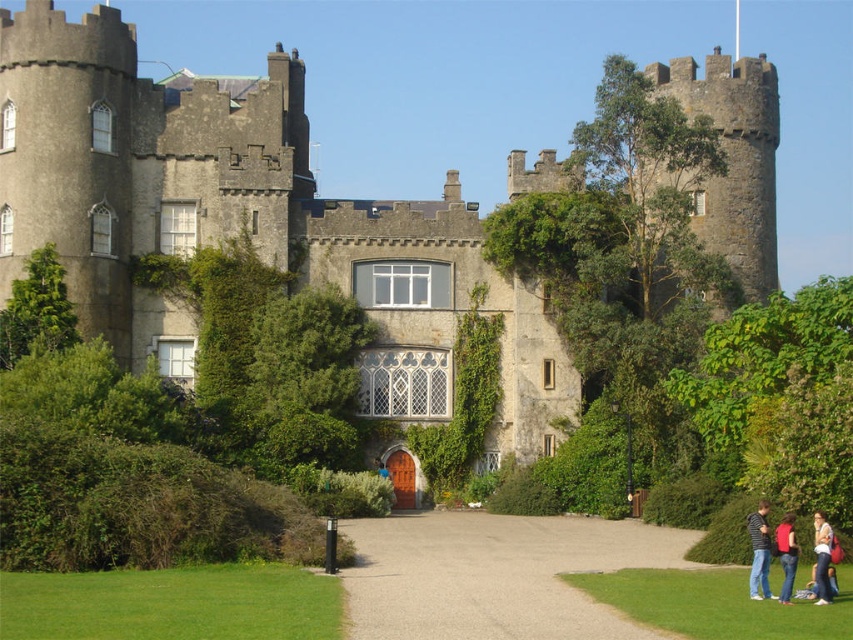
Is smooth gravel path at center positioned in front of denim jacket at lower right?

Yes, it is.

Between smooth gravel path at center and denim jacket at lower right, which one has less height?

denim jacket at lower right is shorter.

Is point (497, 564) behind point (824, 515)?

No, it is not.

Image resolution: width=853 pixels, height=640 pixels. In order to click on smooth gravel path at center in this screenshot , I will do `click(496, 573)`.

Which is in front, point (582, 609) or point (786, 554)?

Positioned in front is point (582, 609).

You are a GUI agent. You are given a task and a screenshot of the screen. Output one action in this format:
    pyautogui.click(x=<x>, y=<y>)
    Task: Click on the smooth gravel path at center
    This screenshot has height=640, width=853.
    Given the screenshot: What is the action you would take?
    pyautogui.click(x=496, y=573)

The height and width of the screenshot is (640, 853). In order to click on smooth gravel path at center in this screenshot , I will do `click(496, 573)`.

Is point (419, 484) farther from viewer compared to point (784, 560)?

Yes.

Who is more distant from viewer, (759, 83) or (785, 516)?

Positioned behind is point (759, 83).

Is point (41, 67) more distant than point (788, 545)?

Yes, it is behind point (788, 545).

At what (x,y) coordinates should I click in order to perform the action: click on stone castle at center. Please return your answer as a coordinate pair (x, y). Looking at the image, I should click on (242, 218).